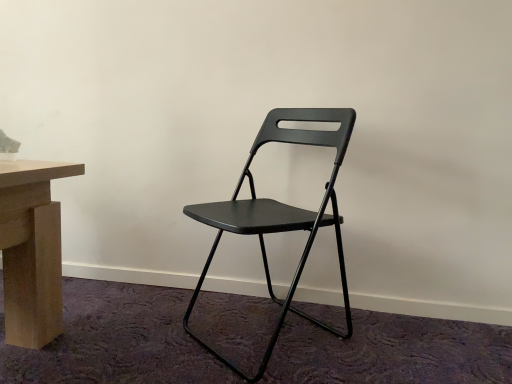
You are a GUI agent. You are given a task and a screenshot of the screen. Output one action in this format:
    pyautogui.click(x=<x>, y=<y>)
    Task: Click on the free space to the right of matte black folding chair at center
    Image resolution: width=512 pixels, height=384 pixels.
    Given the screenshot: What is the action you would take?
    pyautogui.click(x=385, y=329)